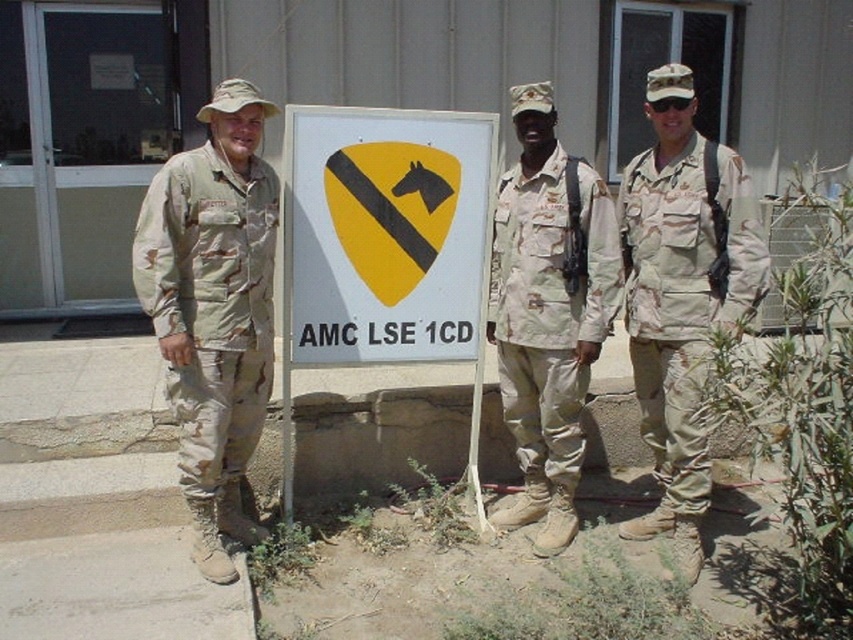
You are a photographer trying to capture a group photo of the three individuals wearing camouflage uniforms. You notice two uniforms labeled as camouflage uniform at center and camouflage fabric uniform at center. Which one is positioned to the right of the other?

The camouflage uniform at center is positioned to the right of the camouflage fabric uniform at center.

You are a drone operator trying to capture a clear photo of the camouflage uniform at center from your current position. Given that your camera has a minimum focus distance of 10 feet, will you be able to take a clear photo without moving closer?

The camouflage uniform at center is 9.76 feet away from the viewer. Since the minimum focus distance is 10 feet, the drone is too close to capture a clear photo without moving back.